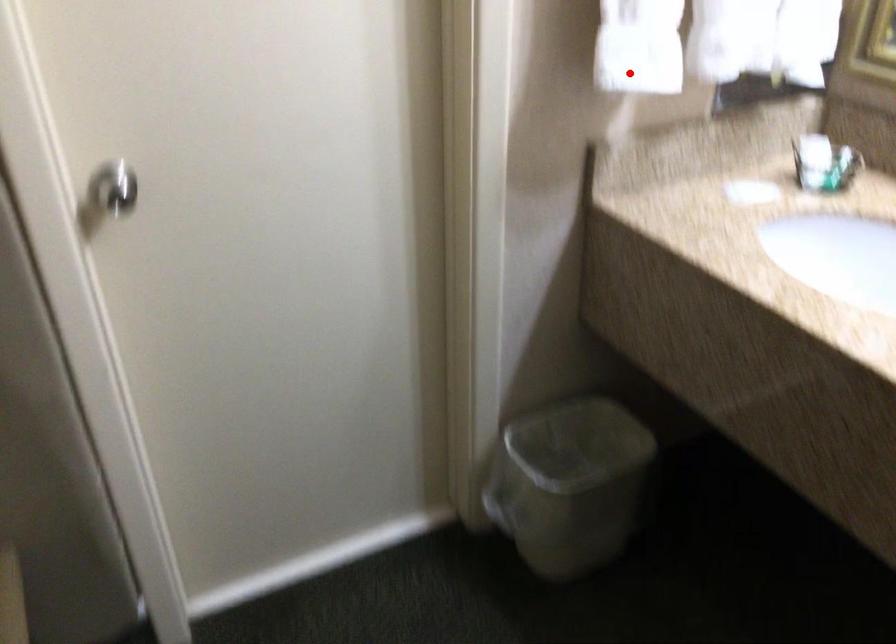
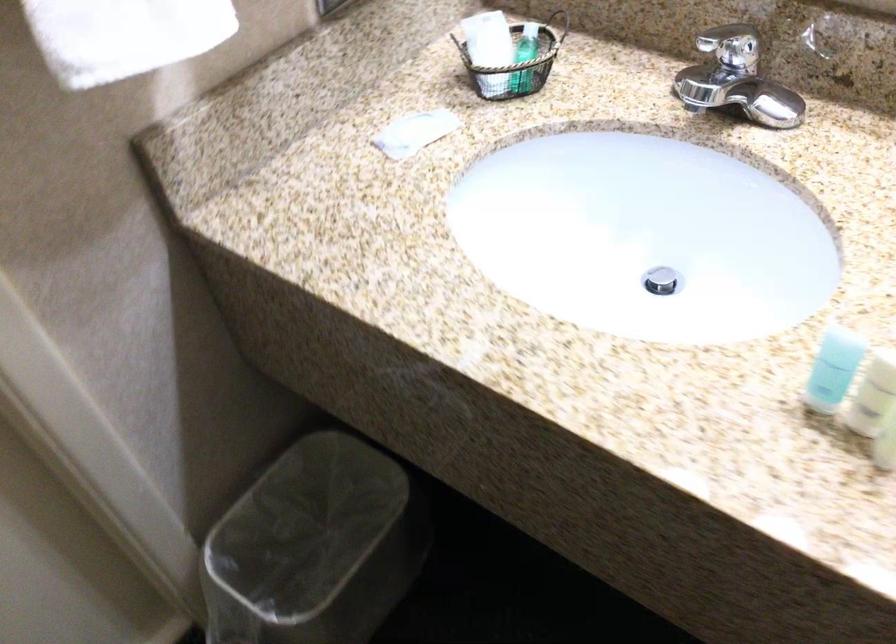
Question: A red point is marked in image1. In image2, is the corresponding 3D point closer to the camera or farther? Reply with the corresponding letter.

Choices:
 (A) The corresponding 3D point is closer.
 (B) The corresponding 3D point is farther.

Answer: (A)